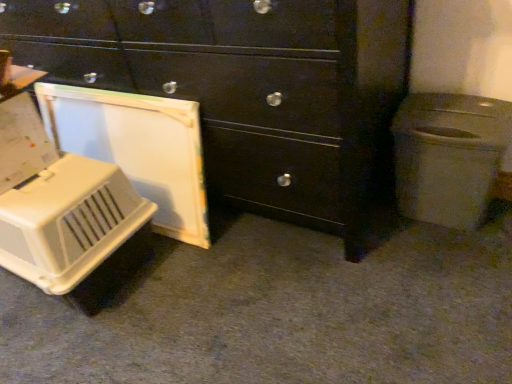
Question: Is white plastic pet carrier at lower left inside the boundaries of white plastic trash can at right, or outside?

Choices:
 (A) outside
 (B) inside

Answer: (A)

Question: In terms of width, does white plastic pet carrier at lower left look wider or thinner when compared to white plastic trash can at right?

Choices:
 (A) thin
 (B) wide

Answer: (B)

Question: Estimate the real-world distances between objects in this image. Which object is farther from the matte black chest of drawers at center?

Choices:
 (A) white plastic pet carrier at lower left
 (B) white plastic pet carrier at left
 (C) white plastic trash can at right

Answer: (A)

Question: Based on their relative distances, which object is farther from the white plastic trash can at right?

Choices:
 (A) white plastic pet carrier at lower left
 (B) white plastic pet carrier at left
 (C) matte black chest of drawers at center

Answer: (A)